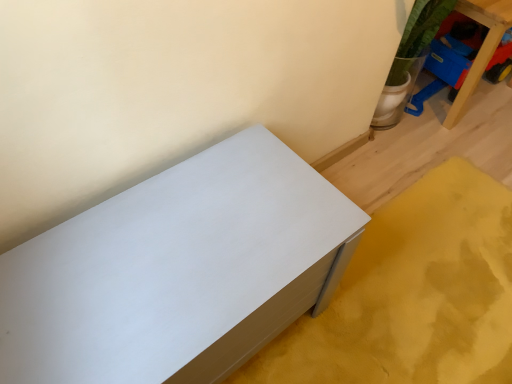
Question: Is white matte chest of drawers at lower left, which is the second furniture in top-to-bottom order, wider or thinner than blue plastic toy at upper right, marked as the second furniture in a bottom-to-top arrangement?

Choices:
 (A) thin
 (B) wide

Answer: (B)

Question: Is white matte chest of drawers at lower left, the first furniture when ordered from front to back, in front of or behind blue plastic toy at upper right, the second furniture viewed from the left, in the image?

Choices:
 (A) front
 (B) behind

Answer: (A)

Question: From a real-world perspective, is white matte chest of drawers at lower left, the first furniture when ordered from front to back, physically located above or below blue plastic toy at upper right, marked as the first furniture in a back-to-front arrangement?

Choices:
 (A) below
 (B) above

Answer: (A)

Question: Relative to white matte chest of drawers at lower left, which is the second furniture in top-to-bottom order, is blue plastic toy at upper right, marked as the first furniture in a back-to-front arrangement, in front or behind?

Choices:
 (A) behind
 (B) front

Answer: (A)

Question: Is point coord(479,19) closer or farther from the camera than point coord(165,235)?

Choices:
 (A) farther
 (B) closer

Answer: (A)

Question: Choose the correct answer: Is blue plastic toy at upper right, marked as the first furniture in a back-to-front arrangement, inside white matte chest of drawers at lower left, which is the 2th furniture from back to front, or outside it?

Choices:
 (A) inside
 (B) outside

Answer: (B)

Question: Considering the positions of blue plastic toy at upper right, which is counted as the 1th furniture, starting from the top, and white matte chest of drawers at lower left, which is the second furniture in top-to-bottom order, in the image, is blue plastic toy at upper right, which is counted as the 1th furniture, starting from the top, wider or thinner than white matte chest of drawers at lower left, which is the second furniture in top-to-bottom order,?

Choices:
 (A) wide
 (B) thin

Answer: (B)